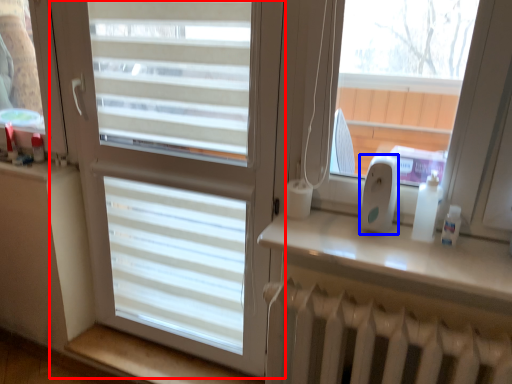
Question: Among these objects, which one is nearest to the camera, window (highlighted by a red box) or ipod (highlighted by a blue box)?

Choices:
 (A) window
 (B) ipod

Answer: (B)